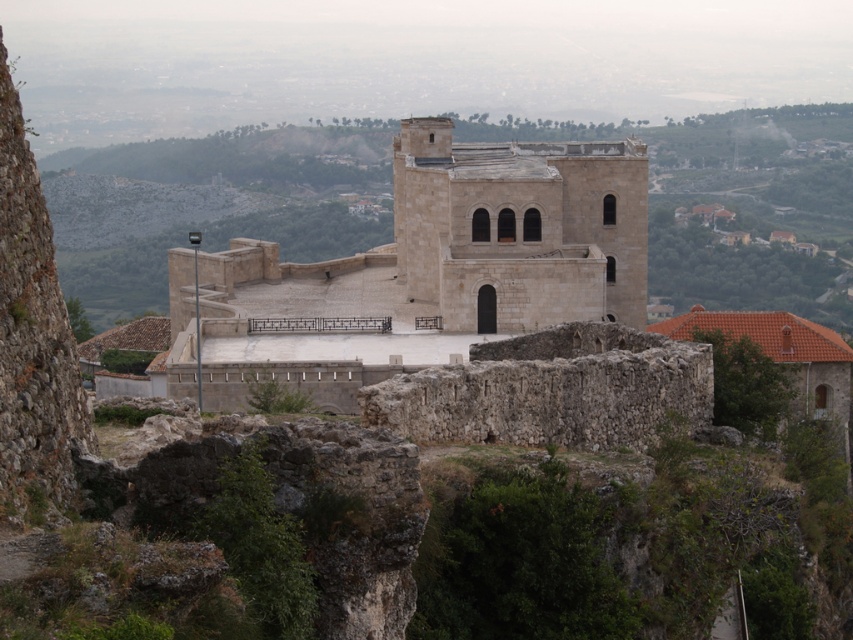
Based on the photo, between beige stone castle at center and white stone tower at center, which one appears on the left side from the viewer's perspective?

Positioned to the left is beige stone castle at center.

Can you confirm if beige stone castle at center is thinner than white stone tower at center?

In fact, beige stone castle at center might be wider than white stone tower at center.

The image size is (853, 640). I want to click on beige stone castle at center, so click(x=425, y=269).

Identify the location of beige stone castle at center. The width and height of the screenshot is (853, 640). tap(425, 269).